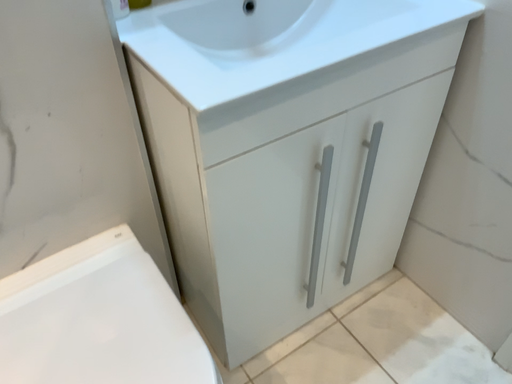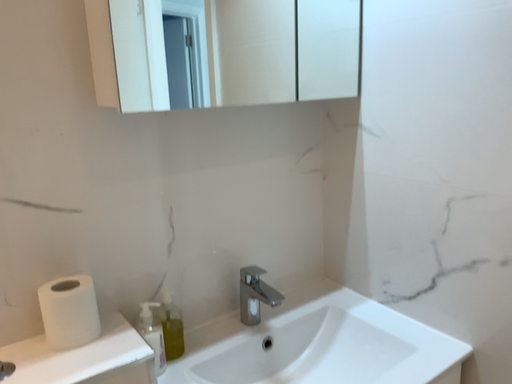
Question: Which way did the camera rotate in the video?

Choices:
 (A) rotated upward
 (B) rotated downward

Answer: (A)